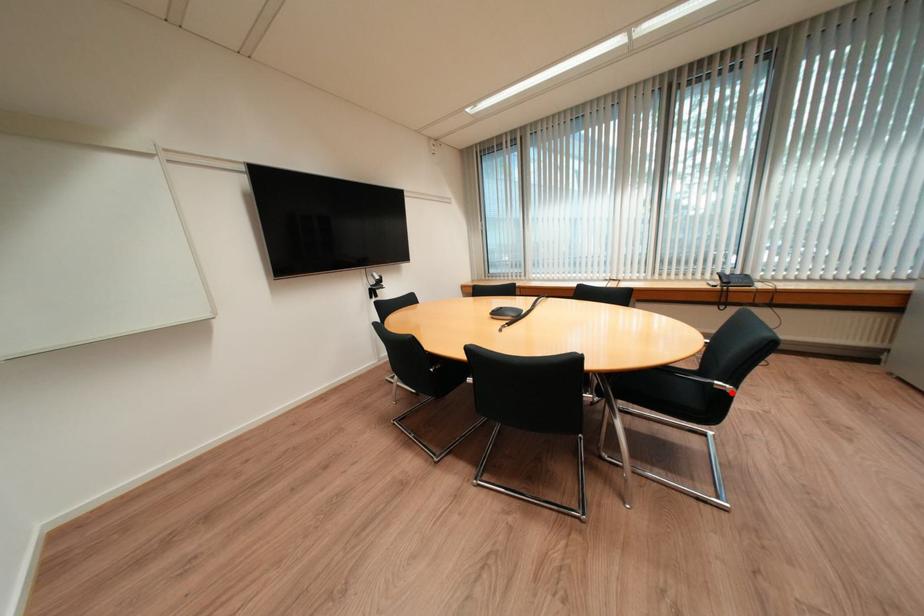
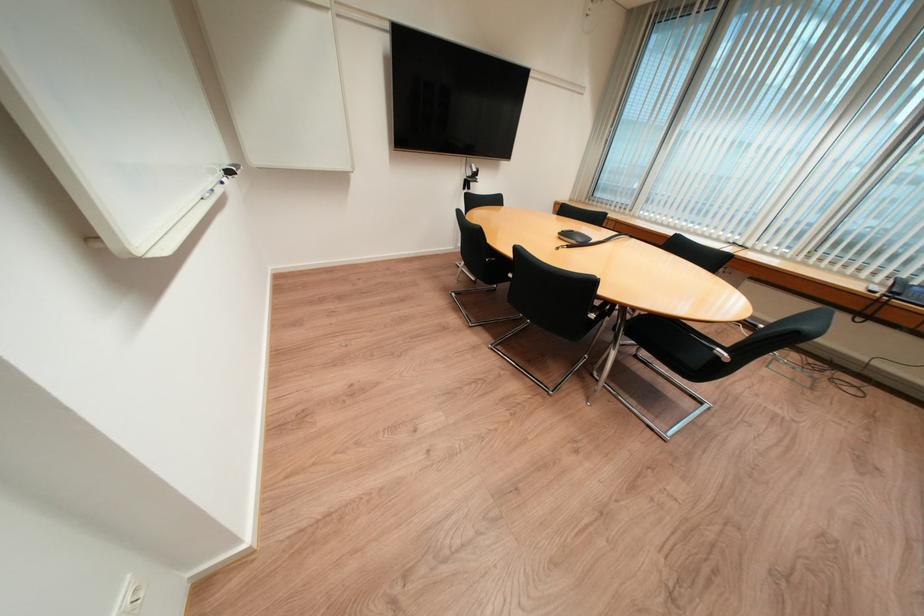
Question: I am providing you with two images of the same scene from different viewpoints. A red point is marked on the first image. Can you still see the location of the red point in image 2?

Choices:
 (A) Yes
 (B) No

Answer: (A)